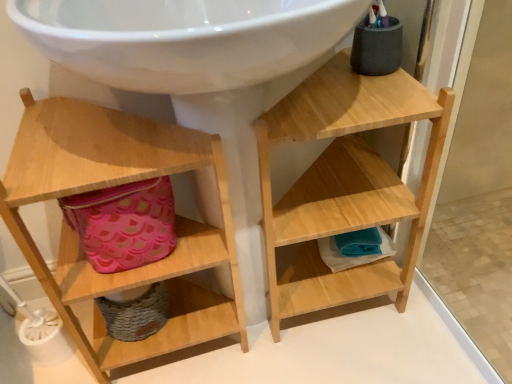
Question: Does natural wood shelf at upper right, the 1th shelf when ordered from right to left, appear on the left side of pink fabric basket at lower left?

Choices:
 (A) yes
 (B) no

Answer: (B)

Question: Considering the relative sizes of natural wood shelf at upper right, the 2th shelf from the left, and pink fabric basket at lower left in the image provided, is natural wood shelf at upper right, the 2th shelf from the left, bigger than pink fabric basket at lower left?

Choices:
 (A) no
 (B) yes

Answer: (B)

Question: Are natural wood shelf at upper right, the 2th shelf from the left, and pink fabric basket at lower left far apart?

Choices:
 (A) yes
 (B) no

Answer: (B)

Question: From a real-world perspective, is natural wood shelf at upper right, the 1th shelf when ordered from right to left, physically above pink fabric basket at lower left?

Choices:
 (A) yes
 (B) no

Answer: (B)

Question: Is natural wood shelf at upper right, the 1th shelf when ordered from right to left, wider than pink fabric basket at lower left?

Choices:
 (A) no
 (B) yes

Answer: (B)

Question: From their relative heights in the image, would you say natural wood shelf at upper right, the 1th shelf when ordered from right to left, is taller or shorter than wooden shelf at left, which is counted as the 2th shelf, starting from the right?

Choices:
 (A) tall
 (B) short

Answer: (B)

Question: Would you say natural wood shelf at upper right, the 2th shelf from the left, is to the left or to the right of wooden shelf at left, the first shelf from the left, in the picture?

Choices:
 (A) right
 (B) left

Answer: (A)

Question: Is natural wood shelf at upper right, the 2th shelf from the left, inside or outside of wooden shelf at left, which is counted as the 2th shelf, starting from the right?

Choices:
 (A) inside
 (B) outside

Answer: (B)

Question: Is natural wood shelf at upper right, the 2th shelf from the left, wider or thinner than wooden shelf at left, which is counted as the 2th shelf, starting from the right?

Choices:
 (A) thin
 (B) wide

Answer: (B)

Question: From a real-world perspective, is wooden shelf at left, which is counted as the 2th shelf, starting from the right, positioned above or below pink fabric basket at lower left?

Choices:
 (A) below
 (B) above

Answer: (A)

Question: In the image, is wooden shelf at left, which is counted as the 2th shelf, starting from the right, positioned in front of or behind pink fabric basket at lower left?

Choices:
 (A) front
 (B) behind

Answer: (A)

Question: Considering the positions of wooden shelf at left, the first shelf from the left, and pink fabric basket at lower left in the image, is wooden shelf at left, the first shelf from the left, bigger or smaller than pink fabric basket at lower left?

Choices:
 (A) big
 (B) small

Answer: (A)

Question: Considering the positions of point (52, 291) and point (116, 241), is point (52, 291) closer or farther from the camera than point (116, 241)?

Choices:
 (A) closer
 (B) farther

Answer: (A)

Question: In terms of size, does wooden shelf at left, which is counted as the 2th shelf, starting from the right, appear bigger or smaller than natural wood shelf at upper right, the 2th shelf from the left?

Choices:
 (A) big
 (B) small

Answer: (A)

Question: Is wooden shelf at left, which is counted as the 2th shelf, starting from the right, taller or shorter than natural wood shelf at upper right, the 2th shelf from the left?

Choices:
 (A) tall
 (B) short

Answer: (A)